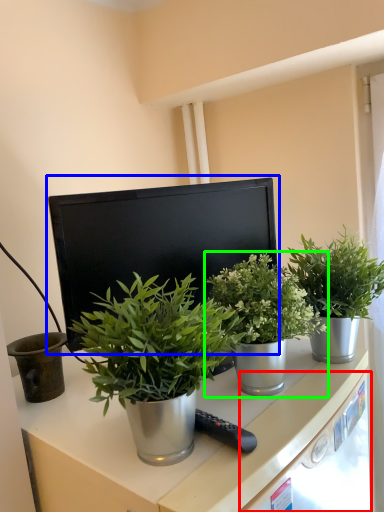
Question: Considering the real-world distances, which object is farthest from drawer (highlighted by a red box)? computer monitor (highlighted by a blue box) or houseplant (highlighted by a green box)?

Choices:
 (A) computer monitor
 (B) houseplant

Answer: (A)